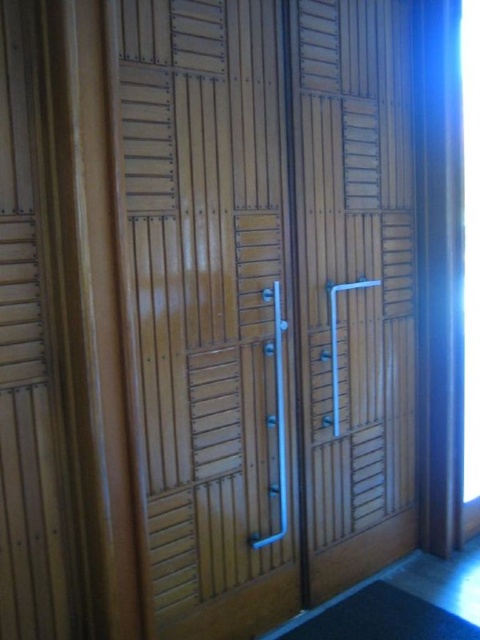
You are a painter who needs to apply a coat of paint to the wooden door. You have a 30 inch long paintbrush. If you stand in front of the door, can you reach both the wooden at center and the wooden slats at left with the same brush without moving your position?

The wooden at center and wooden slats at left are 29.15 inches apart from each other. Since the paintbrush is 30 inches long, you can reach both areas with the same brush without moving your position because the distance between them is less than the brush length.

You are standing in front of a wooden door with two handles. You notice two parts of the door labeled as wooden at center and wooden slats at left. Which part is taller?

The wooden at center is taller than the wooden slats at left.